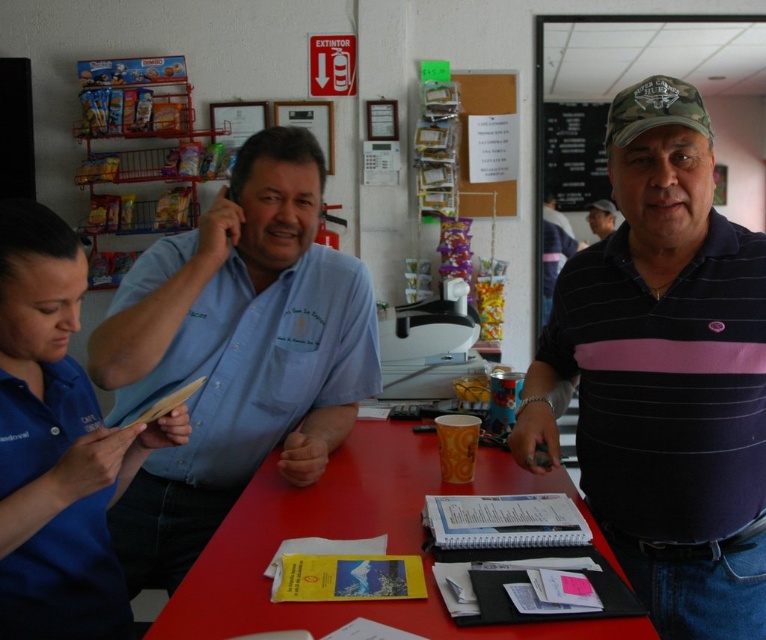
Where is the blue fabric shirt at upper left located in the image?

The blue fabric shirt at upper left is located at point (57,444) in the image.